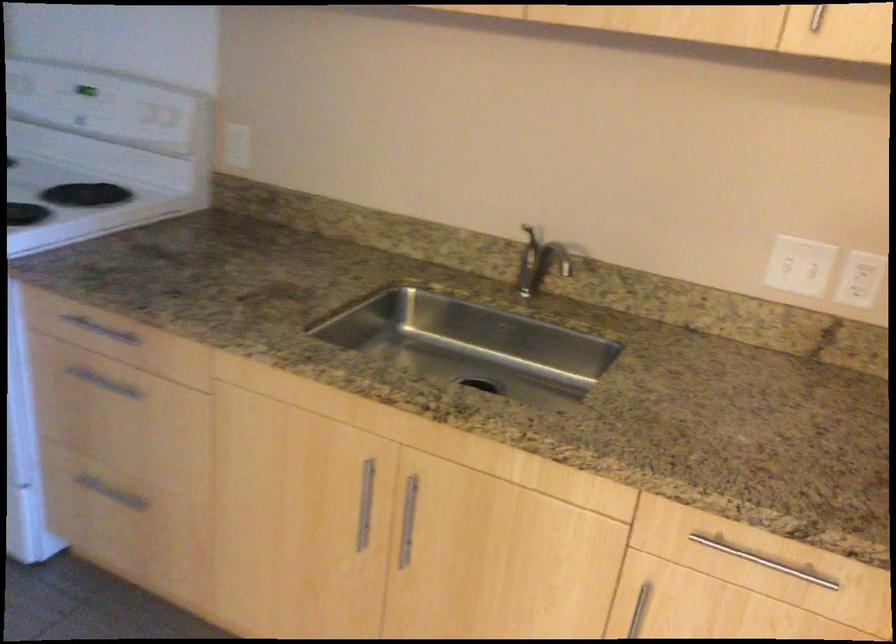
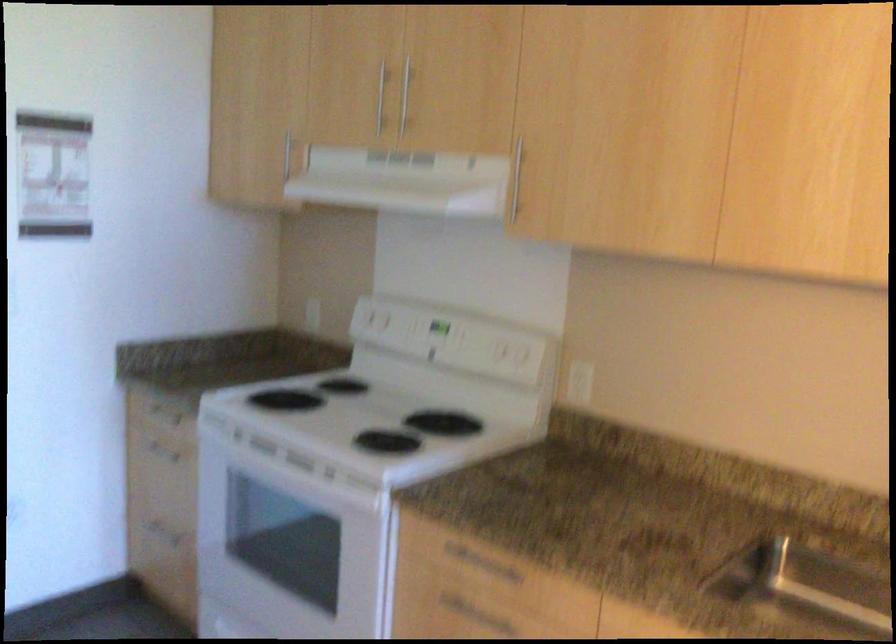
Where in the second image is the point corresponding to point 99,330 from the first image?

(480, 564)